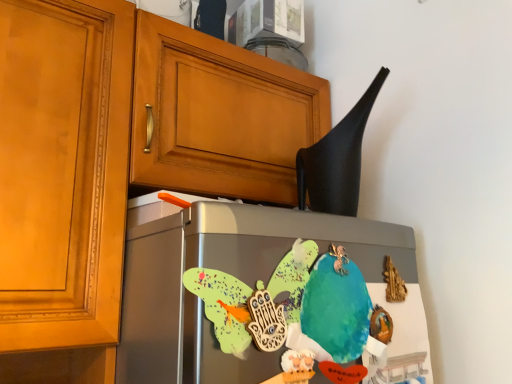
What do you see at coordinates (119, 160) in the screenshot?
I see `matte wood cabinet at upper left` at bounding box center [119, 160].

What do you see at coordinates (337, 160) in the screenshot?
I see `black matte exhaust hood at upper right` at bounding box center [337, 160].

Where is `satin silver fridge at center`? satin silver fridge at center is located at coordinates (267, 294).

From the image's perspective, would you say watercolor paper parrot at center is positioned over matte wood cabinet at upper left?

No.

Which is behind, point (331, 332) or point (53, 303)?

Positioned behind is point (53, 303).

Are watercolor paper parrot at center and matte wood cabinet at upper left far apart?

No, watercolor paper parrot at center is not far away from matte wood cabinet at upper left.

Would you say watercolor paper parrot at center is inside or outside matte wood cabinet at upper left?

watercolor paper parrot at center exists outside the volume of matte wood cabinet at upper left.

Considering the relative positions of watercolor paper parrot at center and black matte exhaust hood at upper right in the image provided, is watercolor paper parrot at center to the left or to the right of black matte exhaust hood at upper right?

Clearly, watercolor paper parrot at center is on the left of black matte exhaust hood at upper right in the image.

Is watercolor paper parrot at center not close to black matte exhaust hood at upper right?

Actually, watercolor paper parrot at center and black matte exhaust hood at upper right are a little close together.

Considering the relative sizes of watercolor paper parrot at center and black matte exhaust hood at upper right in the image provided, is watercolor paper parrot at center bigger than black matte exhaust hood at upper right?

No, watercolor paper parrot at center is not bigger than black matte exhaust hood at upper right.

From the picture: From a real-world perspective, does watercolor paper parrot at center stand above black matte exhaust hood at upper right?

Actually, watercolor paper parrot at center is physically below black matte exhaust hood at upper right in the real world.

Is matte wood cabinet at upper left positioned with its back to satin silver fridge at center?

No.

Is matte wood cabinet at upper left in front of or behind satin silver fridge at center in the image?

matte wood cabinet at upper left is positioned farther from the viewer than satin silver fridge at center.

Which of these two, matte wood cabinet at upper left or satin silver fridge at center, stands taller?

matte wood cabinet at upper left is taller.

Considering the sizes of objects matte wood cabinet at upper left and satin silver fridge at center in the image provided, who is bigger, matte wood cabinet at upper left or satin silver fridge at center?

Bigger between the two is matte wood cabinet at upper left.

Is black matte exhaust hood at upper right far from watercolor paper parrot at center?

No, black matte exhaust hood at upper right is not far away from watercolor paper parrot at center.

From a real-world perspective, does black matte exhaust hood at upper right sit lower than watercolor paper parrot at center?

No.

Considering the relative positions of black matte exhaust hood at upper right and watercolor paper parrot at center in the image provided, is black matte exhaust hood at upper right in front of watercolor paper parrot at center?

No, black matte exhaust hood at upper right is further to the viewer.

Between black matte exhaust hood at upper right and watercolor paper parrot at center, which one has larger width?

black matte exhaust hood at upper right is wider.

Can you confirm if black matte exhaust hood at upper right is smaller than satin silver fridge at center?

Indeed, black matte exhaust hood at upper right has a smaller size compared to satin silver fridge at center.

Can you confirm if black matte exhaust hood at upper right is thinner than satin silver fridge at center?

No, black matte exhaust hood at upper right is not thinner than satin silver fridge at center.

Which is correct: black matte exhaust hood at upper right is inside satin silver fridge at center, or outside of it?

black matte exhaust hood at upper right is not enclosed by satin silver fridge at center.

Consider the image. Is matte wood cabinet at upper left positioned with its back to black matte exhaust hood at upper right?

matte wood cabinet at upper left is not turned away from black matte exhaust hood at upper right.

Which object is more forward, matte wood cabinet at upper left or black matte exhaust hood at upper right?

matte wood cabinet at upper left is more forward.

Considering the points (0, 276) and (350, 149), which point is behind, point (0, 276) or point (350, 149)?

The point (350, 149) is more distant.

From the image's perspective, is matte wood cabinet at upper left above or below black matte exhaust hood at upper right?

From the image's perspective, matte wood cabinet at upper left appears below black matte exhaust hood at upper right.

How far apart are satin silver fridge at center and watercolor paper parrot at center?

satin silver fridge at center and watercolor paper parrot at center are 4.25 inches apart.

Is satin silver fridge at center inside or outside of watercolor paper parrot at center?

satin silver fridge at center lies outside watercolor paper parrot at center.

Which object is wider, satin silver fridge at center or watercolor paper parrot at center?

satin silver fridge at center is wider.

Is satin silver fridge at center oriented towards watercolor paper parrot at center?

Yes, satin silver fridge at center is oriented towards watercolor paper parrot at center.

Image resolution: width=512 pixels, height=384 pixels. In order to click on parrot located below the matte wood cabinet at upper left (from the image's perspective) in this screenshot , I will do `click(336, 306)`.

Find the location of a particular element. The height and width of the screenshot is (384, 512). exhaust hood lying behind the watercolor paper parrot at center is located at coordinates (337, 160).

When comparing their distances from satin silver fridge at center, does watercolor paper parrot at center or matte wood cabinet at upper left seem further?

matte wood cabinet at upper left lies further to satin silver fridge at center than the other object.

Considering their positions, is matte wood cabinet at upper left positioned further to black matte exhaust hood at upper right than watercolor paper parrot at center?

matte wood cabinet at upper left lies further to black matte exhaust hood at upper right than the other object.

Based on their spatial positions, is matte wood cabinet at upper left or satin silver fridge at center closer to black matte exhaust hood at upper right?

satin silver fridge at center is positioned closer to the anchor black matte exhaust hood at upper right.

Considering their positions, is satin silver fridge at center positioned further to matte wood cabinet at upper left than black matte exhaust hood at upper right?

Among the two, black matte exhaust hood at upper right is located further to matte wood cabinet at upper left.

Based on their spatial positions, is watercolor paper parrot at center or satin silver fridge at center closer to black matte exhaust hood at upper right?

watercolor paper parrot at center.

Considering their positions, is matte wood cabinet at upper left positioned closer to satin silver fridge at center than black matte exhaust hood at upper right?

Among the two, black matte exhaust hood at upper right is located nearer to satin silver fridge at center.

Estimate the real-world distances between objects in this image. Which object is further from watercolor paper parrot at center, matte wood cabinet at upper left or satin silver fridge at center?

Among the two, matte wood cabinet at upper left is located further to watercolor paper parrot at center.

Consider the image. Based on their spatial positions, is satin silver fridge at center or watercolor paper parrot at center closer to black matte exhaust hood at upper right?

The object closer to black matte exhaust hood at upper right is watercolor paper parrot at center.

In order to click on parrot between matte wood cabinet at upper left and black matte exhaust hood at upper right in this screenshot , I will do `click(336, 306)`.

This screenshot has height=384, width=512. Find the location of `parrot between black matte exhaust hood at upper right and satin silver fridge at center in the up-down direction`. parrot between black matte exhaust hood at upper right and satin silver fridge at center in the up-down direction is located at coordinates (336, 306).

I want to click on refrigerator between matte wood cabinet at upper left and black matte exhaust hood at upper right from left to right, so click(x=267, y=294).

Where is `refrigerator between matte wood cabinet at upper left and watercolor paper parrot at center in the horizontal direction`? The image size is (512, 384). refrigerator between matte wood cabinet at upper left and watercolor paper parrot at center in the horizontal direction is located at coordinates (267, 294).